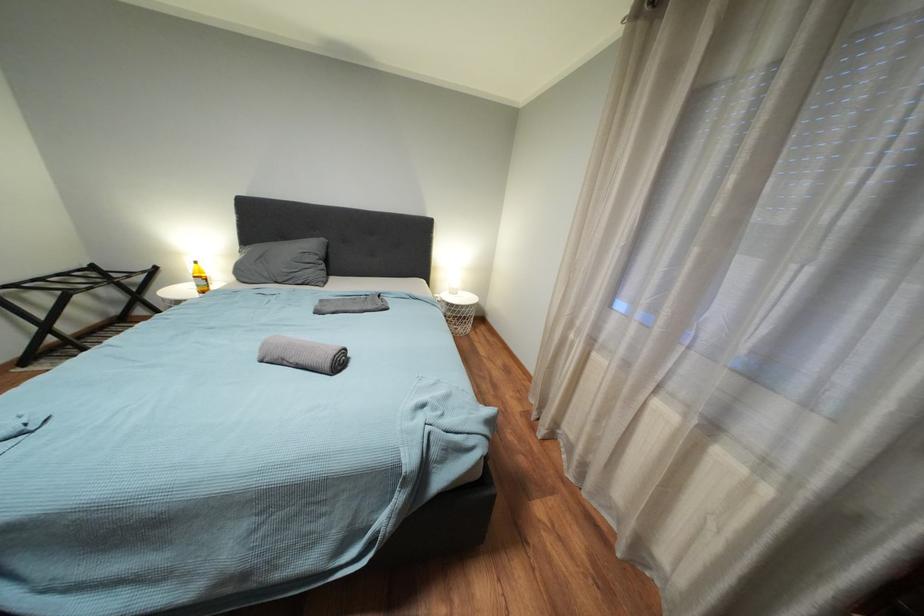
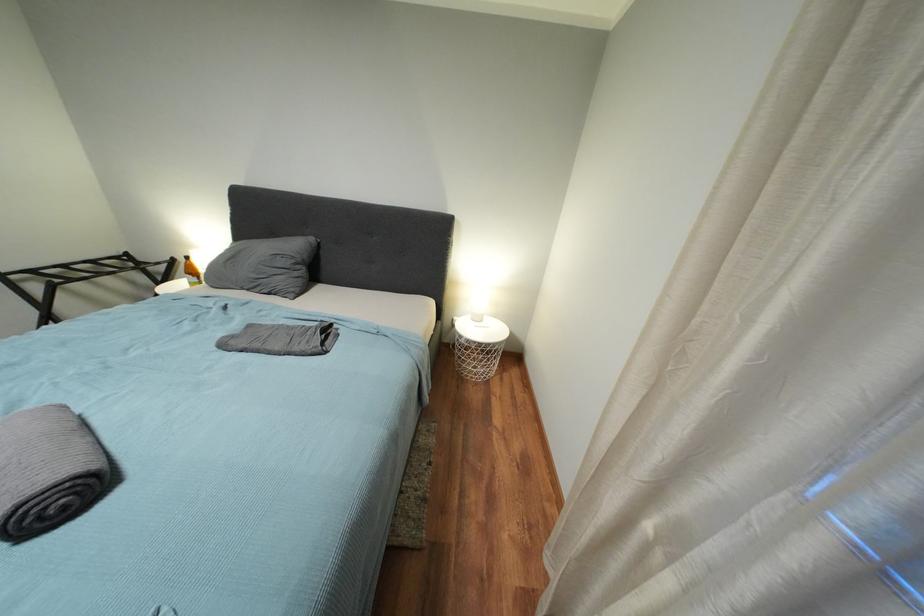
In a continuous first-person perspective shot, in which direction is the camera moving?

The cameraman walked toward right, forward.